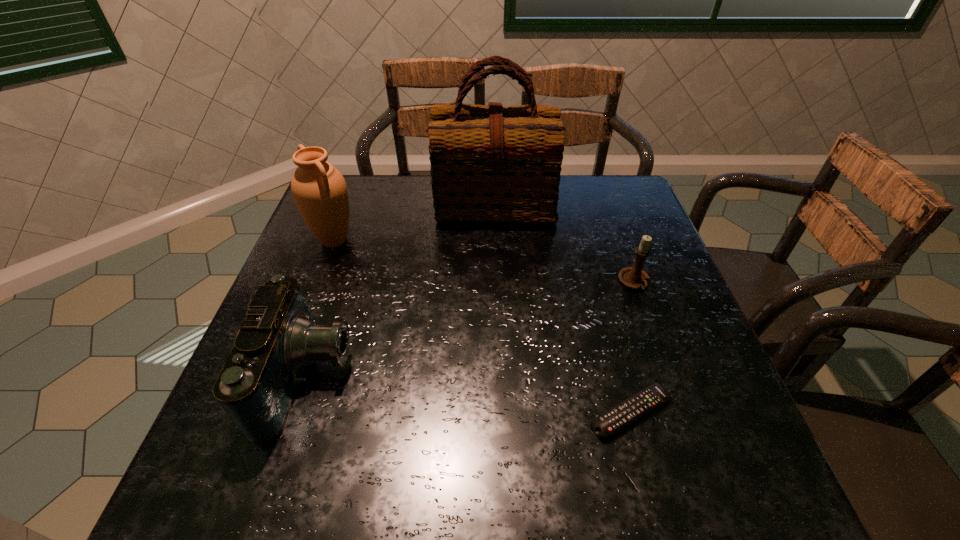
Where is `free space located 0.130m on the left of the remote control`? The image size is (960, 540). free space located 0.130m on the left of the remote control is located at coordinates (516, 413).

You are a GUI agent. You are given a task and a screenshot of the screen. Output one action in this format:
    pyautogui.click(x=<x>, y=<y>)
    Task: Click on the object that is at the far edge
    
    Given the screenshot: What is the action you would take?
    pyautogui.click(x=493, y=163)

This screenshot has height=540, width=960. Identify the location of urn that is at the left edge. (319, 190).

This screenshot has width=960, height=540. What are the coordinates of `camcorder present at the left edge` in the screenshot? It's located at (257, 385).

What are the coordinates of `candle holder at the right edge` in the screenshot? It's located at (634, 277).

Where is `remote control at the right edge`? The image size is (960, 540). remote control at the right edge is located at coordinates (608, 423).

Find the location of a particular element. This screenshot has height=540, width=960. vacant space at the near edge is located at coordinates (391, 505).

At what (x,y) coordinates should I click in order to perform the action: click on free space at the left edge of the desktop. Please return your answer as a coordinate pair (x, y). The height and width of the screenshot is (540, 960). Looking at the image, I should click on (326, 303).

Locate an element on the screen. vacant space at the right edge of the desktop is located at coordinates (675, 290).

In the image, there is a desktop. Where is `vacant space at the far left corner`? vacant space at the far left corner is located at coordinates (364, 219).